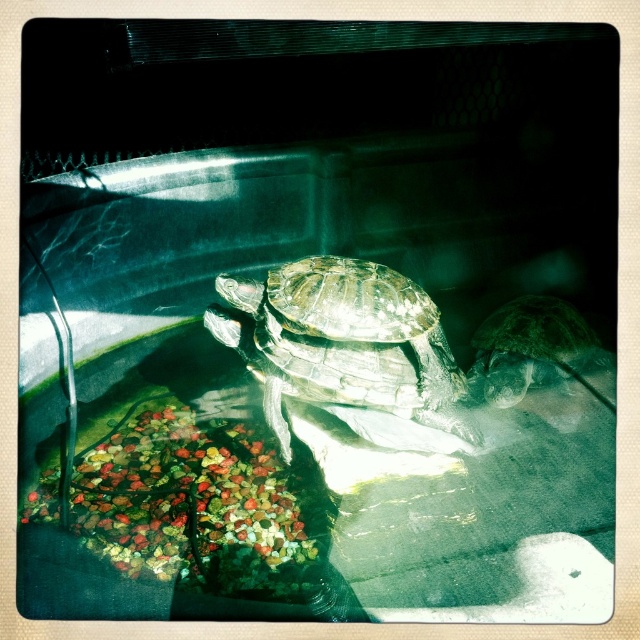
Question: Is shiny brown tortoise at center below shiny green tortoise at right?

Choices:
 (A) yes
 (B) no

Answer: (B)

Question: Which point is closer to the camera taking this photo?

Choices:
 (A) (419, 362)
 (B) (544, 310)

Answer: (A)

Question: Among these points, which one is nearest to the camera?

Choices:
 (A) (563, 333)
 (B) (348, 406)

Answer: (B)

Question: Can you confirm if shiny brown tortoise at center is bigger than shiny green tortoise at right?

Choices:
 (A) no
 (B) yes

Answer: (B)

Question: Does shiny brown tortoise at center appear over shiny green tortoise at right?

Choices:
 (A) no
 (B) yes

Answer: (B)